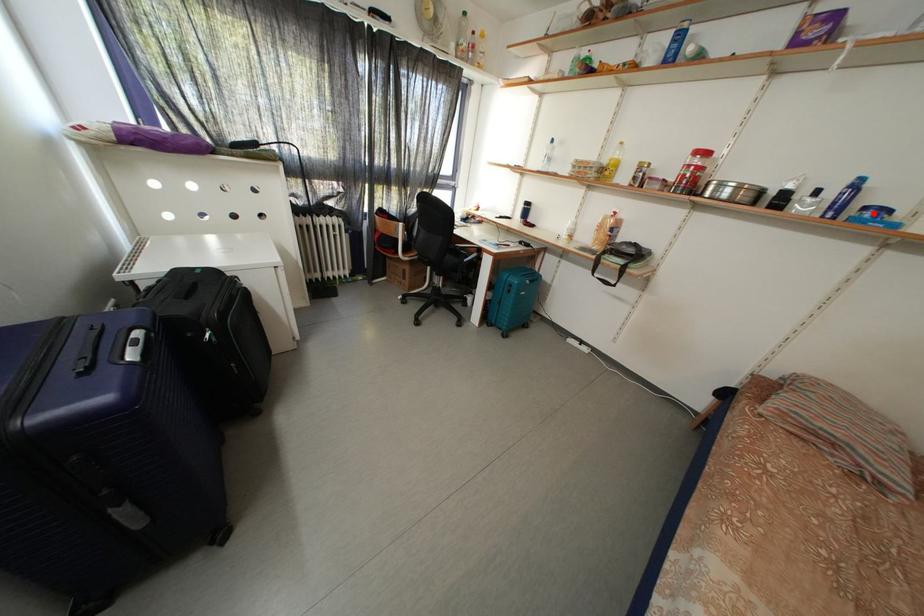
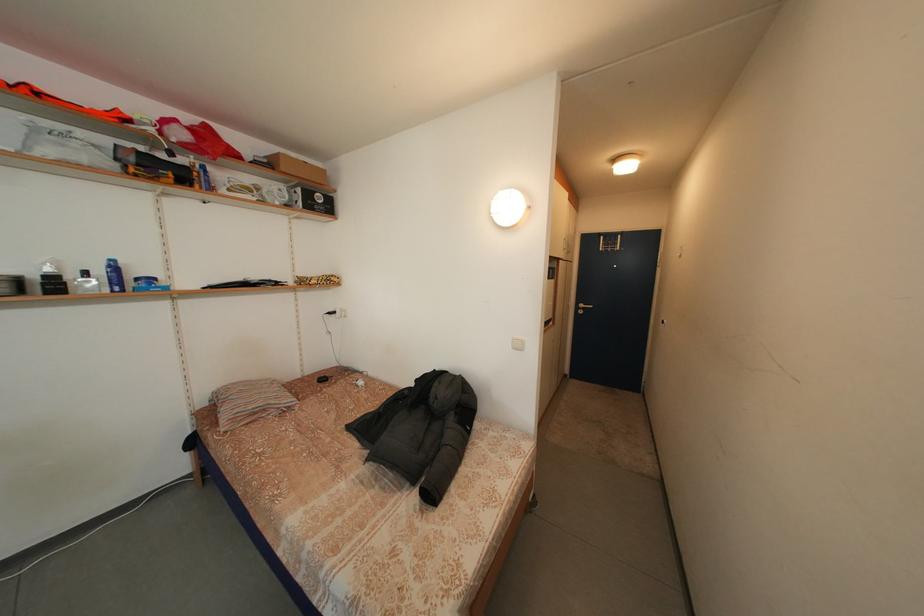
Question: A red point is marked in image1. In image2, is the corresponding 3D point closer to the camera or farther? Reply with the corresponding letter.

Choices:
 (A) The corresponding 3D point is closer.
 (B) The corresponding 3D point is farther.

Answer: (A)